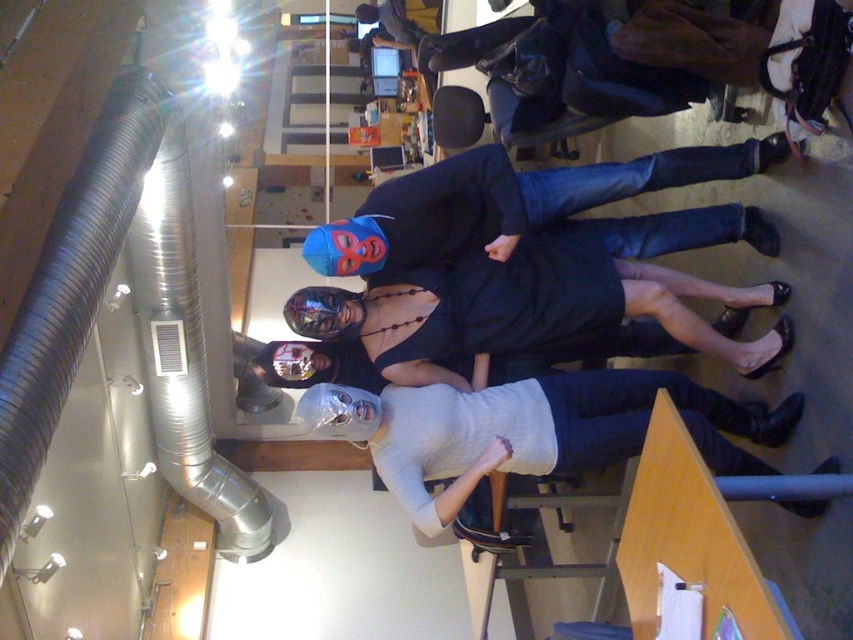
You are a photographer trying to arrange two masks for a photo shoot. The masks are the white matte mask at center and the matte black mask at center. Based on their sizes, which mask should you place higher up in the frame to ensure they appear balanced?

The white matte mask at center is not as tall as matte black mask at center, so to balance their sizes, you should place the white matte mask at center higher up in the frame to compensate for its smaller height.